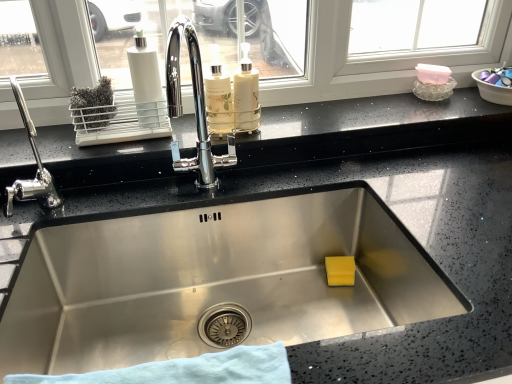
I want to click on spots to the right of chrome metallic faucet at left, so click(x=118, y=202).